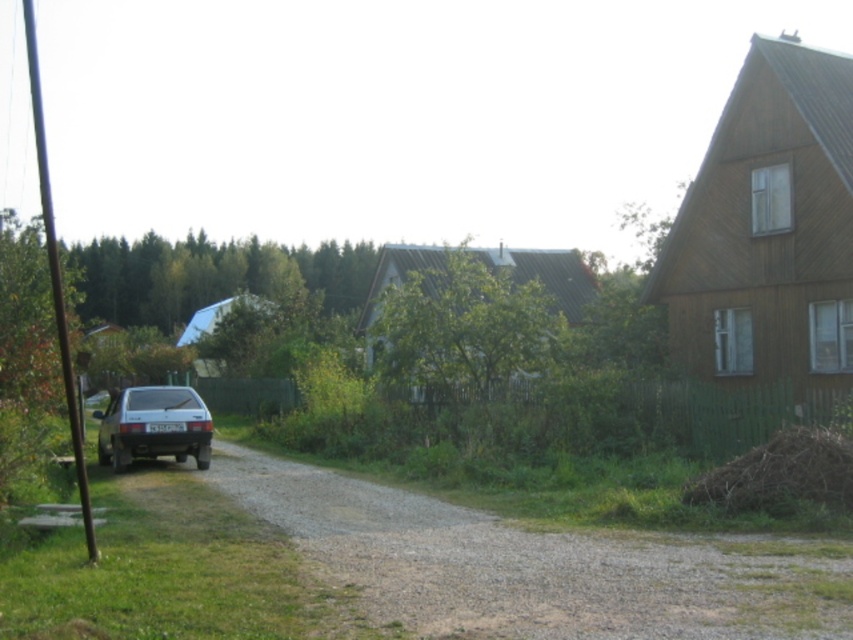
What is the 2D coordinate of the gray gravel driveway at lower left in the image?

The gray gravel driveway at lower left is located at the 2D coordinate point of (532, 564).

You are a delivery person trying to park your truck on the gray gravel driveway at lower left. However, there is a satin silver car at left parked there. Can you still park your truck on the driveway without moving the car?

The gray gravel driveway at lower left is below the satin silver car at left, meaning the car is parked on top of the driveway. Since the driveway is below, there might be space underneath the car to park the truck, but typically vehicles cannot park under another parked car. Therefore, you cannot park your truck on the driveway without moving the satin silver car at left.